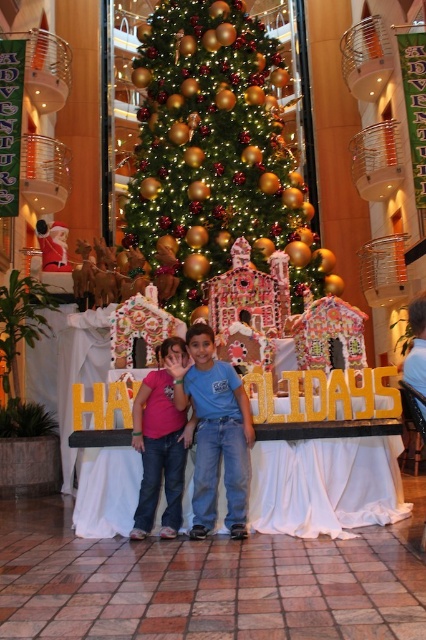
Is point (204, 109) positioned after point (166, 390)?

Yes, point (204, 109) is farther from viewer.

Between green shiny christmas tree at center and pink fabric shirt at center, which one has less height?

pink fabric shirt at center is shorter.

Is point (160, 138) positioned before point (154, 413)?

That is False.

This screenshot has height=640, width=426. I want to click on green shiny christmas tree at center, so click(215, 150).

Is pink fabric dress at center below pink fabric shirt at center?

No, pink fabric dress at center is not below pink fabric shirt at center.

Between pink fabric dress at center and pink fabric shirt at center, which one has more height?

pink fabric dress at center is taller.

The width and height of the screenshot is (426, 640). I want to click on pink fabric dress at center, so click(x=215, y=433).

Is point (316, 276) in front of point (199, 433)?

No, (316, 276) is behind (199, 433).

Is green shiny christmas tree at center positioned in front of pink fabric dress at center?

That is False.

At what (x,y) coordinates should I click in order to perform the action: click on green shiny christmas tree at center. Please return your answer as a coordinate pair (x, y). This screenshot has height=640, width=426. Looking at the image, I should click on (215, 150).